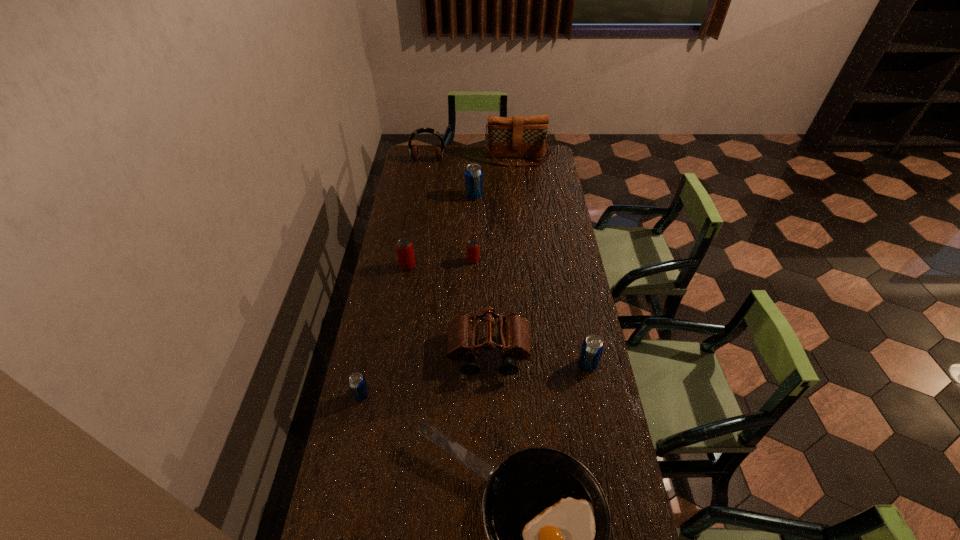
What are the coordinates of `beer can object that ranks as the second closest to the right pink beer can` in the screenshot? It's located at (473, 173).

Find the location of `blue beer can that stands as the second closest to the leftmost blue beer can`. blue beer can that stands as the second closest to the leftmost blue beer can is located at coordinates (473, 173).

What are the coordinates of `blue beer can object that ranks as the closest to the smaller pink beer can` in the screenshot? It's located at (473, 173).

The image size is (960, 540). Find the location of `free region that satisfies the following two spatial constraints: 1. on the front side of the second nearest beer can; 2. on the right side of the left pink beer can`. free region that satisfies the following two spatial constraints: 1. on the front side of the second nearest beer can; 2. on the right side of the left pink beer can is located at coordinates (392, 364).

Find the location of a particular element. Image resolution: width=960 pixels, height=540 pixels. blank area in the image that satisfies the following two spatial constraints: 1. on the ear cup of the farthest beer can; 2. on the right side of the headset is located at coordinates (422, 197).

The height and width of the screenshot is (540, 960). Find the location of `free location that satisfies the following two spatial constraints: 1. on the ear cup of the brown headset; 2. on the right side of the second farthest blue beer can`. free location that satisfies the following two spatial constraints: 1. on the ear cup of the brown headset; 2. on the right side of the second farthest blue beer can is located at coordinates (396, 364).

I want to click on free space that satisfies the following two spatial constraints: 1. on the back side of the nearest blue beer can; 2. on the left side of the smaller pink beer can, so click(x=390, y=261).

Locate an element on the screen. This screenshot has width=960, height=540. free spot that satisfies the following two spatial constraints: 1. on the front side of the smaller pink beer can; 2. on the right side of the farthest blue beer can is located at coordinates (473, 261).